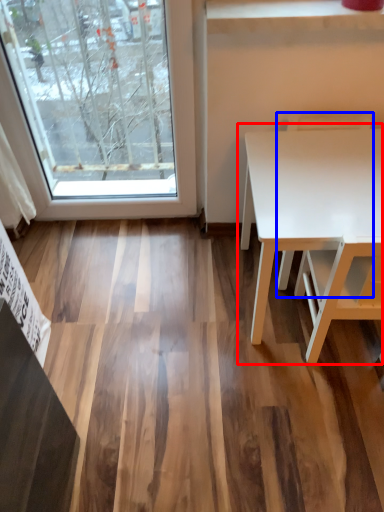
Question: Which object appears closest to the camera in this image, table (highlighted by a red box) or chair (highlighted by a blue box)?

Choices:
 (A) table
 (B) chair

Answer: (A)